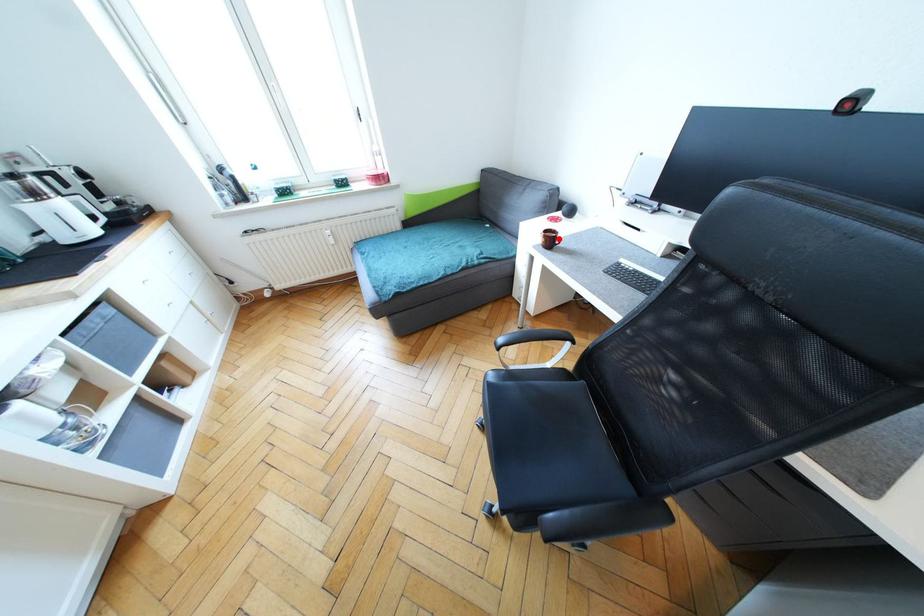
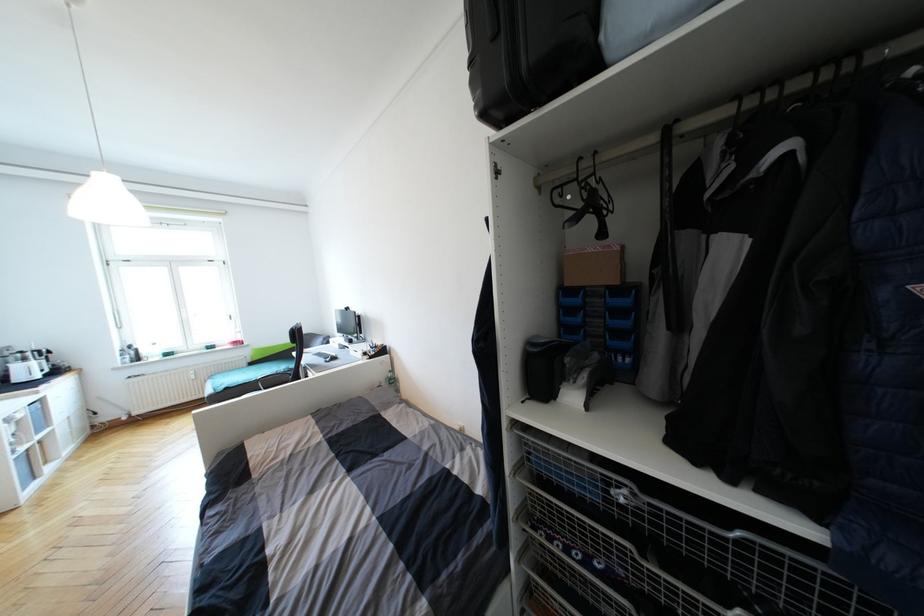
Question: I am providing you with two images of the same scene from different viewpoints. A red point is marked on the first image. Can you still see the location of the red point in image 2?

Choices:
 (A) Yes
 (B) No

Answer: (B)